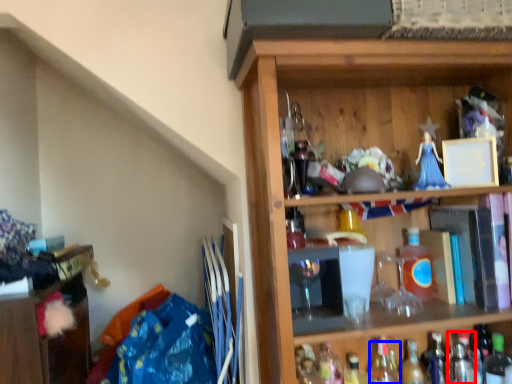
Question: Which object appears closest to the camera in this image, bottle (highlighted by a red box) or bottle (highlighted by a blue box)?

Choices:
 (A) bottle
 (B) bottle

Answer: (A)